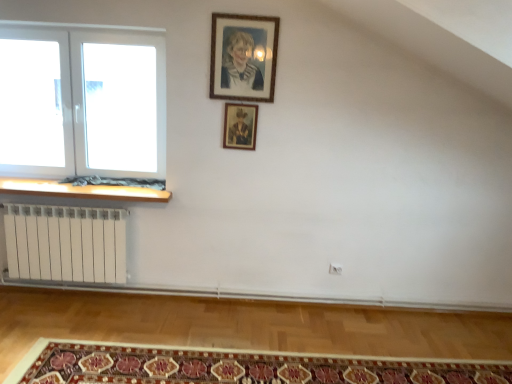
I want to click on vacant space situated above white plastic window at left (from a real-world perspective), so click(86, 26).